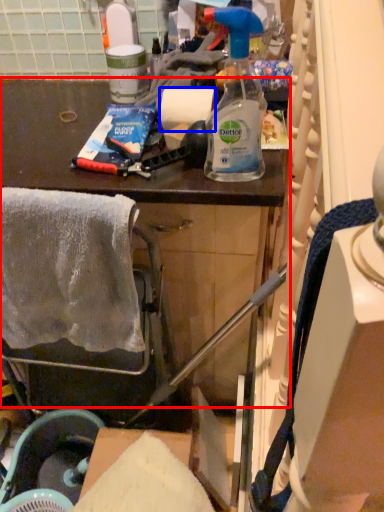
Question: Which object is further to the camera taking this photo, cabinetry (highlighted by a red box) or paper towel (highlighted by a blue box)?

Choices:
 (A) cabinetry
 (B) paper towel

Answer: (B)